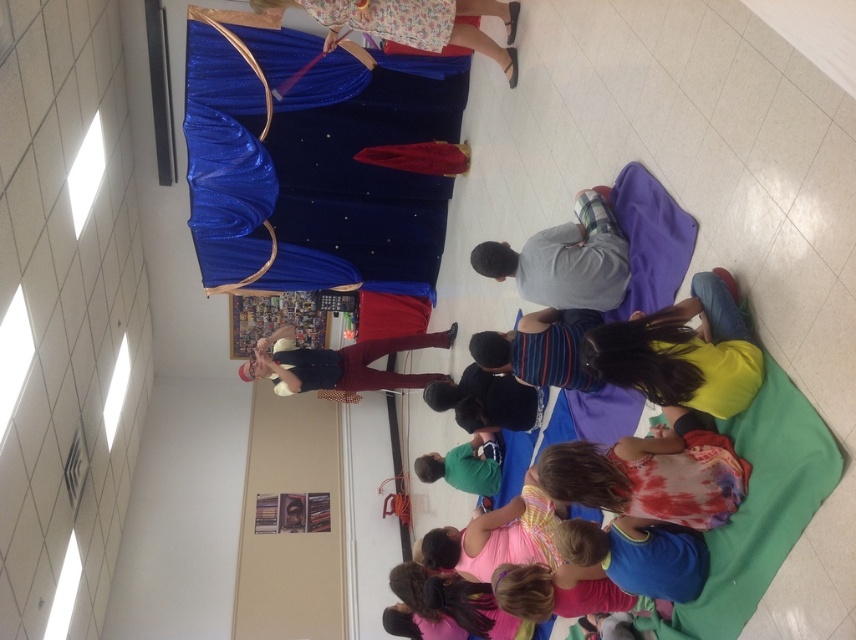
Does gray flannel shirt at center appear over striped cotton shirt at center?

Correct, gray flannel shirt at center is located above striped cotton shirt at center.

Which is behind, point (494, 273) or point (575, 310)?

Point (494, 273)

The height and width of the screenshot is (640, 856). Identify the location of gray flannel shirt at center. (565, 259).

Is black fabric shirt at center positioned before green cotton shirt at lower center?

Yes.

Who is more forward, (509, 410) or (458, 476)?

Positioned in front is point (509, 410).

Image resolution: width=856 pixels, height=640 pixels. I want to click on black fabric shirt at center, so click(x=486, y=401).

This screenshot has height=640, width=856. Describe the element at coordinates (651, 474) in the screenshot. I see `tie-dye fabric shirt at lower center` at that location.

Is point (709, 492) closer to camera compared to point (486, 264)?

Yes, it is in front of point (486, 264).

You are a GUI agent. You are given a task and a screenshot of the screen. Output one action in this format:
    pyautogui.click(x=<x>, y=<y>)
    Task: Click on the tie-dye fabric shirt at lower center
    
    Given the screenshot: What is the action you would take?
    pyautogui.click(x=651, y=474)